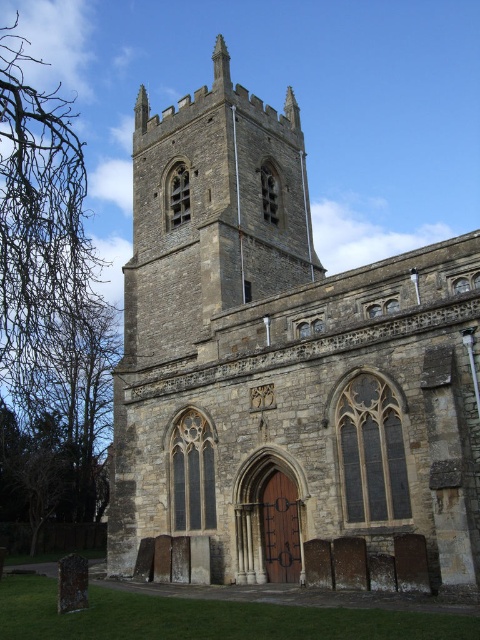
Which is more to the left, stone church at center or stone tower at center?

From the viewer's perspective, stone tower at center appears more on the left side.

Can you confirm if stone church at center is wider than stone tower at center?

In fact, stone church at center might be narrower than stone tower at center.

The image size is (480, 640). What do you see at coordinates (283, 362) in the screenshot? I see `stone church at center` at bounding box center [283, 362].

At what (x,y) coordinates should I click in order to perform the action: click on stone church at center. Please return your answer as a coordinate pair (x, y). Looking at the image, I should click on (283, 362).